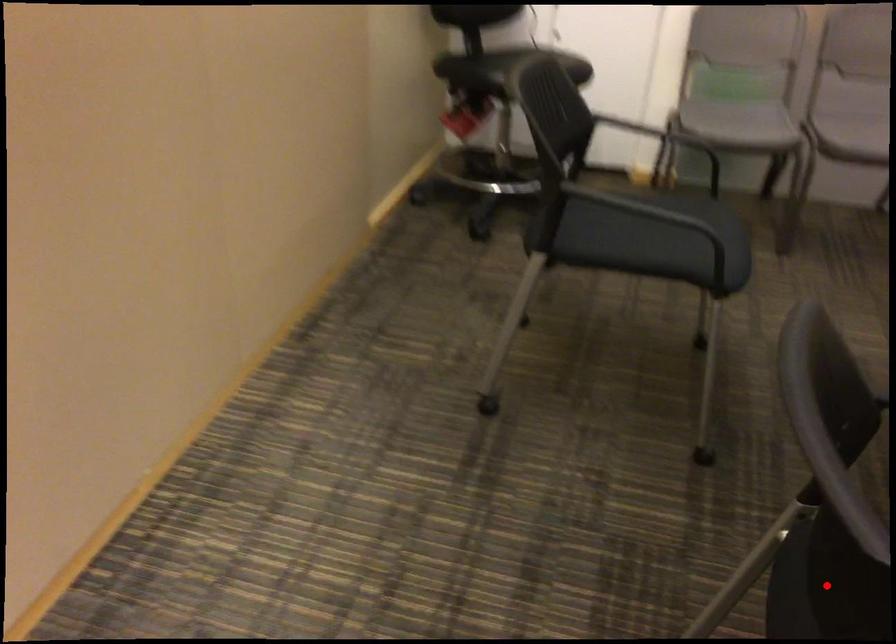
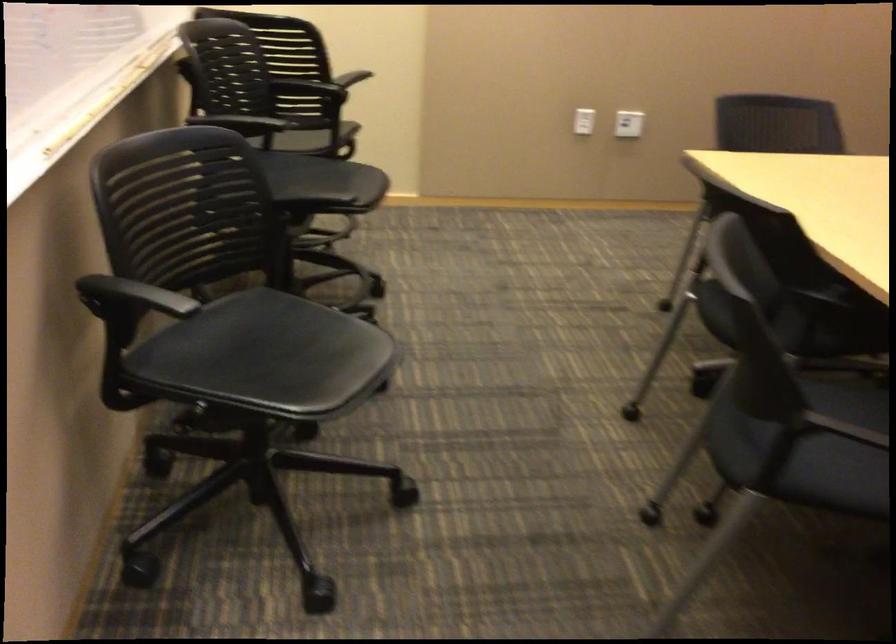
Question: I am providing you with two images of the same scene from different viewpoints. A red point is marked on the first image. Is the red point's position out of view in image 2?

Choices:
 (A) Yes
 (B) No

Answer: (A)